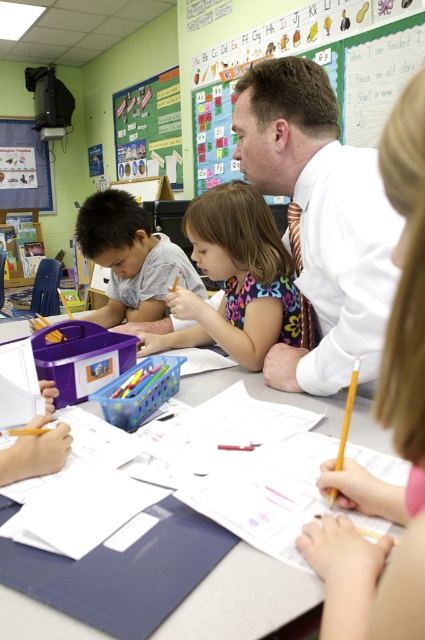
In the scene shown: You are a teacher in the classroom and want to place a new worksheet on the table. The white paper at center is currently in use. Where should you place the new worksheet so it doesn not obstruct the green paperboard at upper center?

You should place the new worksheet above the white paper at center since it is located below the green paperboard at upper center, ensuring it doesn not block the view of the green paperboard.

What object is located at the coordinates point (243, 600) in the classroom scene?

The point (243, 600) corresponds to the white paper at center.